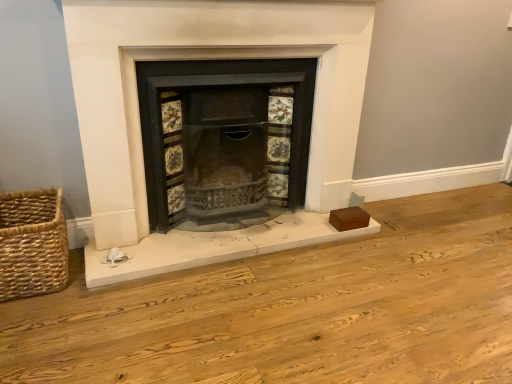
This screenshot has width=512, height=384. Identify the location of vacant area that lies to the right of woven straw basket at lower left. (97, 298).